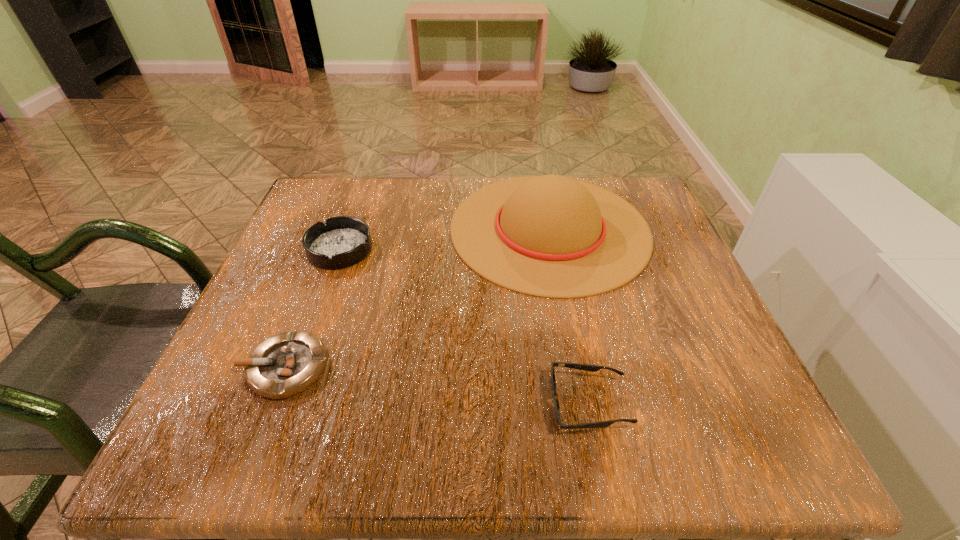
Locate an element on the screen. The image size is (960, 540). sombrero is located at coordinates (551, 236).

Locate an element on the screen. the farther ashtray is located at coordinates (343, 241).

Image resolution: width=960 pixels, height=540 pixels. I want to click on the nearer ashtray, so click(287, 364).

The width and height of the screenshot is (960, 540). I want to click on sunglasses, so click(x=592, y=368).

Find the location of a particular element. This screenshot has width=960, height=540. vacant space located on the left of the sombrero is located at coordinates (420, 228).

I want to click on vacant space located on the front of the farther ashtray, so click(315, 320).

Identify the location of vacant space located on the back of the nearer ashtray. The image size is (960, 540). (324, 267).

You are a GUI agent. You are given a task and a screenshot of the screen. Output one action in this format:
    pyautogui.click(x=<x>, y=<y>)
    Task: Click on the blank space located on the front-facing side of the sunglasses
    
    Given the screenshot: What is the action you would take?
    pyautogui.click(x=390, y=404)

In order to click on vacant area located on the front-facing side of the sunglasses in this screenshot , I will do `click(496, 404)`.

Locate an element on the screen. The width and height of the screenshot is (960, 540). free space located 0.110m on the front-facing side of the sunglasses is located at coordinates (476, 404).